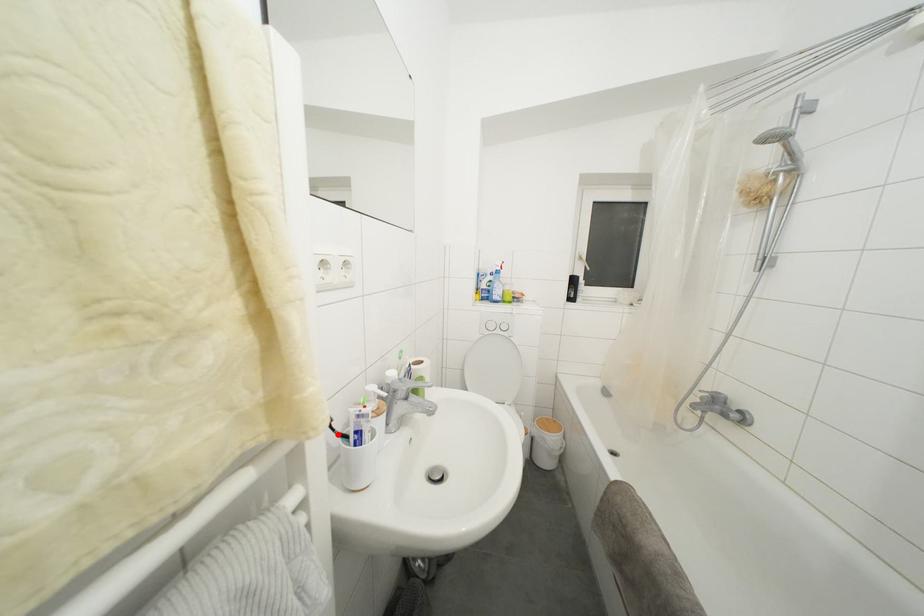
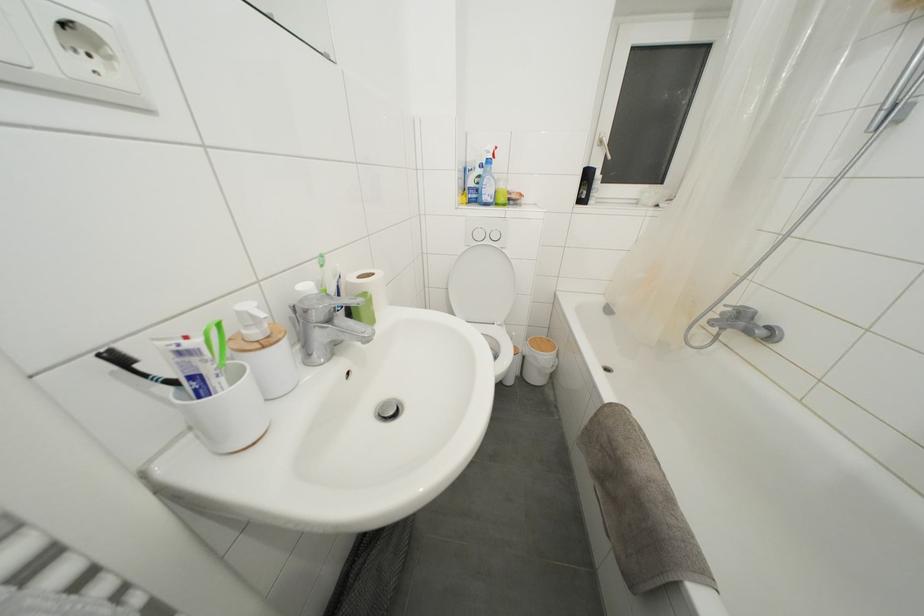
In the second image, find the point that corresponds to the highlighted location in the first image.

(150, 381)